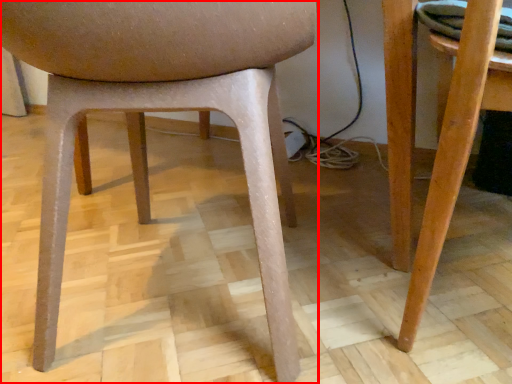
Question: From the image's perspective, where is chair (annotated by the red box) located in relation to table in the image?

Choices:
 (A) below
 (B) above

Answer: (B)